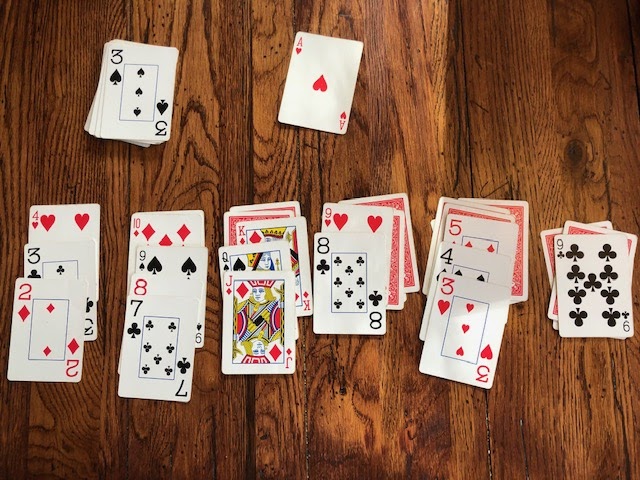
The height and width of the screenshot is (480, 640). In order to click on wooden tabletop in this screenshot , I will do `click(435, 70)`.